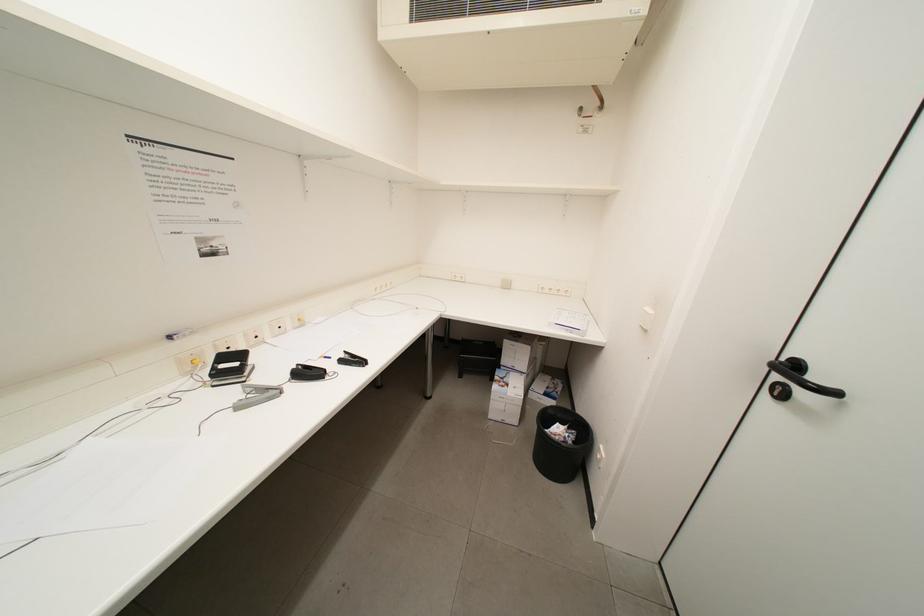
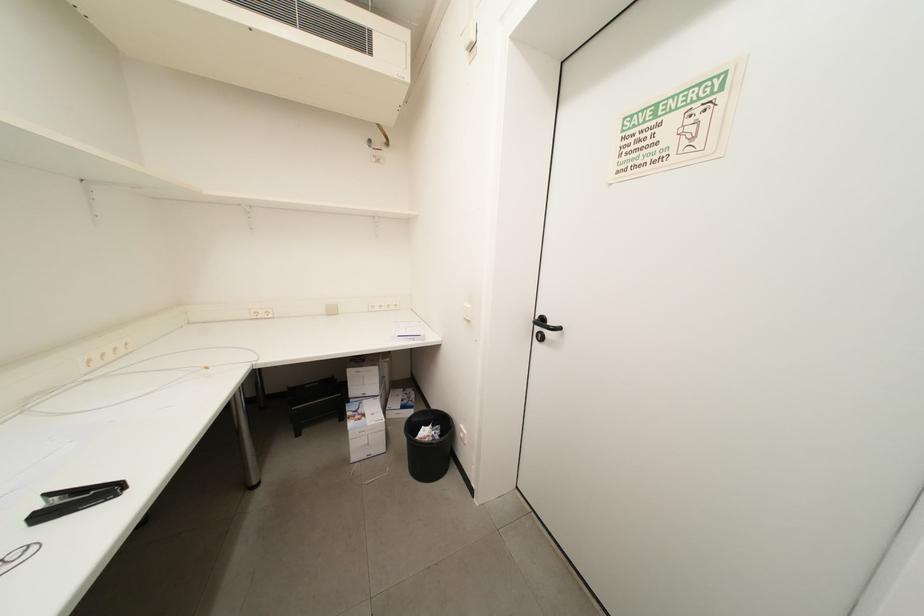
Question: Based on the continuous images, in which direction is the camera rotating? Reply with the corresponding letter.

Choices:
 (A) Left
 (B) Right
 (C) Up
 (D) Down

Answer: (B)